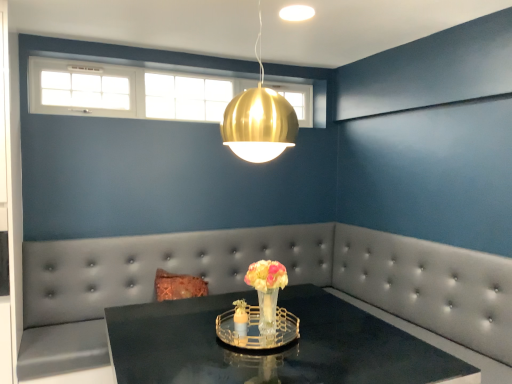
At what (x,y) coordinates should I click in order to perform the action: click on vacant area located to the right-hand side of translucent glass vase at center. Please return your answer as a coordinate pair (x, y). The width and height of the screenshot is (512, 384). Looking at the image, I should click on (317, 336).